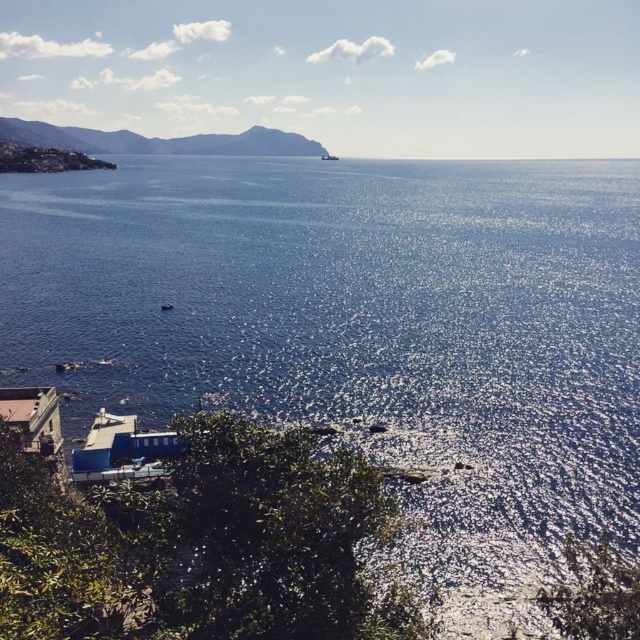
Question: Observing the image, what is the correct spatial positioning of matte stone shoreline at lower left in reference to metallic silver boat at center?

Choices:
 (A) right
 (B) left

Answer: (B)

Question: Does matte stone shoreline at lower left appear under metallic silver boat at center?

Choices:
 (A) no
 (B) yes

Answer: (B)

Question: Is matte stone shoreline at lower left positioned behind metallic silver boat at center?

Choices:
 (A) yes
 (B) no

Answer: (B)

Question: Among these points, which one is farthest from the camera?

Choices:
 (A) (332, 156)
 (B) (22, 170)

Answer: (A)

Question: Which point is closer to the camera?

Choices:
 (A) metallic silver boat at center
 (B) matte stone shoreline at lower left

Answer: (B)